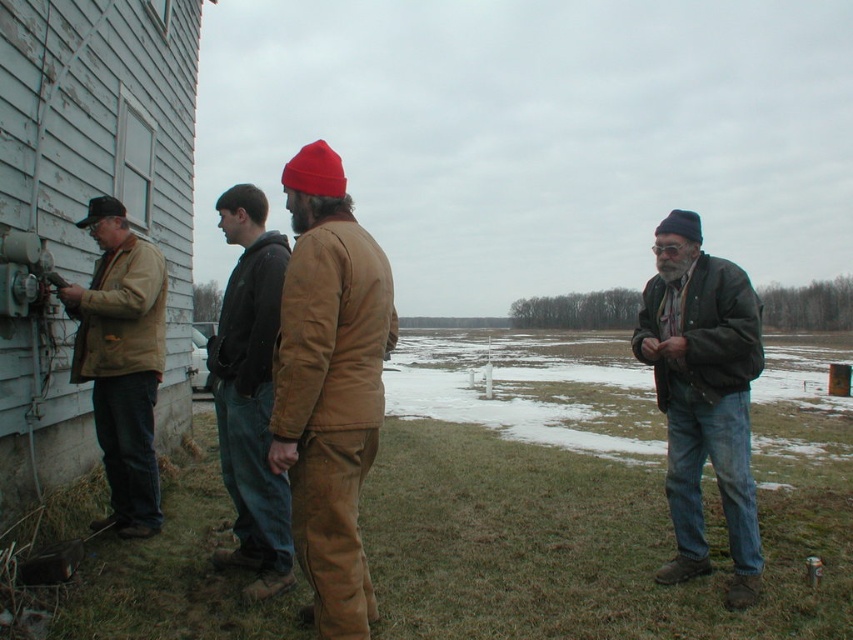
Question: Considering the relative positions of dark green leather jacket at right and matte brown jacket at left in the image provided, where is dark green leather jacket at right located with respect to matte brown jacket at left?

Choices:
 (A) above
 (B) below

Answer: (B)

Question: Considering the real-world distances, which object is farthest from the matte brown jacket at left?

Choices:
 (A) brown leather jacket at center
 (B) brown corduroy pants at center
 (C) dark green leather jacket at right

Answer: (C)

Question: Is dark green leather jacket at right above matte brown jacket at left?

Choices:
 (A) no
 (B) yes

Answer: (A)

Question: Which of these objects is positioned farthest from the matte brown jacket at left?

Choices:
 (A) brown corduroy pants at center
 (B) brown leather jacket at center
 (C) dark green leather jacket at right

Answer: (C)

Question: Can you confirm if dark green leather jacket at right is positioned to the right of brown leather jacket at center?

Choices:
 (A) no
 (B) yes

Answer: (B)

Question: Which of the following is the closest to the observer?

Choices:
 (A) matte brown jacket at left
 (B) brown corduroy pants at center

Answer: (B)